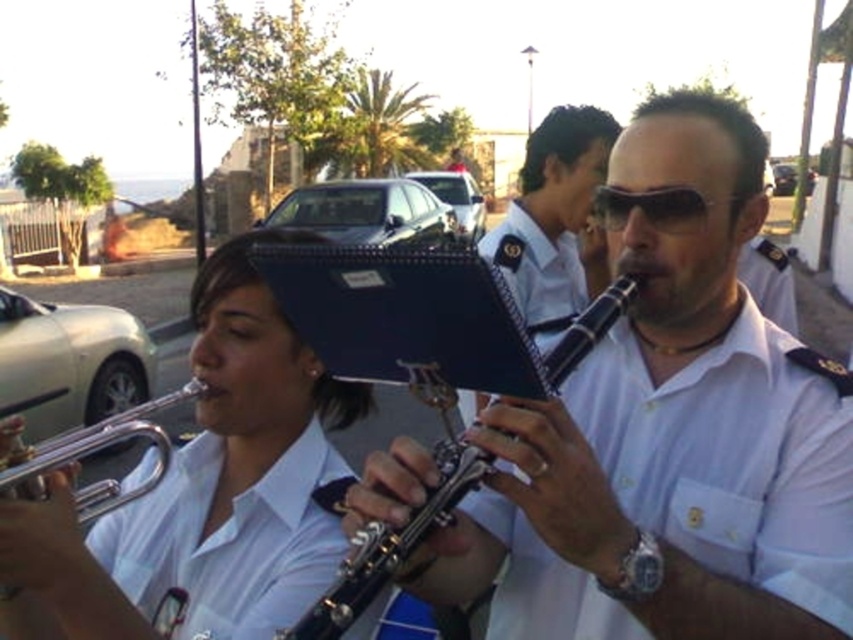
Question: Is the position of white cotton shirt at left less distant than that of metallic silver clarinet at center?

Choices:
 (A) no
 (B) yes

Answer: (A)

Question: Among these points, which one is farthest from the camera?

Choices:
 (A) (544, 621)
 (B) (383, 557)
 (C) (192, 634)

Answer: (C)

Question: Which object is the farthest from the white glossy uniform at center?

Choices:
 (A) metallic silver clarinet at center
 (B) white cotton shirt at left
 (C) sunglasses at center
 (D) silver metallic trumpet at lower left

Answer: (C)

Question: Which point appears closest to the camera in this image?

Choices:
 (A) (292, 515)
 (B) (76, 432)

Answer: (A)

Question: Does white glossy uniform at center have a smaller size compared to sunglasses at center?

Choices:
 (A) no
 (B) yes

Answer: (A)

Question: Is white glossy uniform at center further to the viewer compared to white cotton shirt at left?

Choices:
 (A) yes
 (B) no

Answer: (B)